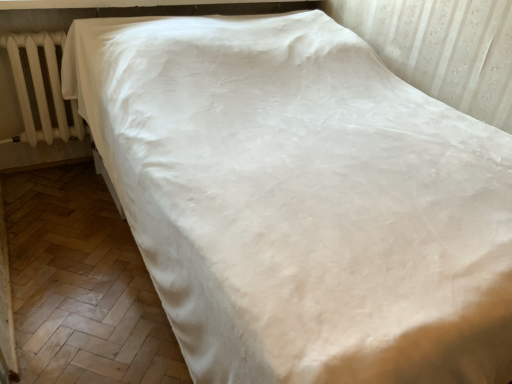
In order to face smooth black window sill at upper center, should I rotate leftwards or rightwards?

To align with it, rotate left about 9.581°.

Where is `smooth black window sill at upper center`? The height and width of the screenshot is (384, 512). smooth black window sill at upper center is located at coordinates (123, 3).

What do you see at coordinates (123, 3) in the screenshot?
I see `smooth black window sill at upper center` at bounding box center [123, 3].

Where is `white plastic radiator at left`? white plastic radiator at left is located at coordinates (41, 88).

What do you see at coordinates (41, 88) in the screenshot? I see `white plastic radiator at left` at bounding box center [41, 88].

From the picture: Measure the distance between point (35, 53) and camera.

2.15 meters.

Locate an element on the screen. The width and height of the screenshot is (512, 384). smooth black window sill at upper center is located at coordinates (123, 3).

Which object is positioned more to the right, smooth black window sill at upper center or white plastic radiator at left?

From the viewer's perspective, smooth black window sill at upper center appears more on the right side.

Between smooth black window sill at upper center and white plastic radiator at left, which one is positioned behind?

Positioned behind is white plastic radiator at left.

Is point (304, 0) in front of point (61, 125)?

No, it is not.

From the image's perspective, is smooth black window sill at upper center above white plastic radiator at left?

Yes, from the image's perspective, smooth black window sill at upper center is on top of white plastic radiator at left.

From a real-world perspective, which is physically above, smooth black window sill at upper center or white plastic radiator at left?

smooth black window sill at upper center is physically above.

Which of these two, smooth black window sill at upper center or white plastic radiator at left, is thinner?

Thinner between the two is white plastic radiator at left.

Considering the relative sizes of smooth black window sill at upper center and white plastic radiator at left in the image provided, is smooth black window sill at upper center shorter than white plastic radiator at left?

Correct, smooth black window sill at upper center is not as tall as white plastic radiator at left.

Between smooth black window sill at upper center and white plastic radiator at left, which one has larger size?

white plastic radiator at left is bigger.

Consider the image. Would you say smooth black window sill at upper center contains white plastic radiator at left?

No, white plastic radiator at left is not inside smooth black window sill at upper center.

Does smooth black window sill at upper center touch white plastic radiator at left?

There is a gap between smooth black window sill at upper center and white plastic radiator at left.

Is smooth black window sill at upper center positioned with its back to white plastic radiator at left?

No.

Can you tell me how much smooth black window sill at upper center and white plastic radiator at left differ in facing direction?

They differ by 0.38 degrees in their facing directions.

This screenshot has height=384, width=512. In the image, there is a smooth black window sill at upper center. Identify the location of radiator below it (from a real-world perspective). (41, 88).

Considering the relative positions of white plastic radiator at left and smooth black window sill at upper center in the image provided, is white plastic radiator at left to the left or to the right of smooth black window sill at upper center?

From the image, it's evident that white plastic radiator at left is to the left of smooth black window sill at upper center.

Is white plastic radiator at left positioned before smooth black window sill at upper center?

No.

Which is nearer, (19, 92) or (10, 8)?

Point (19, 92) is farther from the camera than point (10, 8).

From the image's perspective, is white plastic radiator at left beneath smooth black window sill at upper center?

Yes, from the image's perspective, white plastic radiator at left is below smooth black window sill at upper center.

From a real-world perspective, is white plastic radiator at left physically located above or below smooth black window sill at upper center?

white plastic radiator at left is below smooth black window sill at upper center.

Is white plastic radiator at left wider or thinner than smooth black window sill at upper center?

Considering their sizes, white plastic radiator at left looks slimmer than smooth black window sill at upper center.

Looking at this image, considering the sizes of objects white plastic radiator at left and smooth black window sill at upper center in the image provided, who is taller, white plastic radiator at left or smooth black window sill at upper center?

white plastic radiator at left is taller.

Is white plastic radiator at left bigger or smaller than smooth black window sill at upper center?

Considering their sizes, white plastic radiator at left takes up more space than smooth black window sill at upper center.

Does white plastic radiator at left contain smooth black window sill at upper center?

That's incorrect, smooth black window sill at upper center is not inside white plastic radiator at left.

Is the surface of white plastic radiator at left in direct contact with smooth black window sill at upper center?

No, white plastic radiator at left is not next to smooth black window sill at upper center.

Could you tell me if white plastic radiator at left is facing smooth black window sill at upper center?

No, white plastic radiator at left is not turned towards smooth black window sill at upper center.

How different are the orientations of white plastic radiator at left and smooth black window sill at upper center in degrees?

The angle between the facing direction of white plastic radiator at left and the facing direction of smooth black window sill at upper center is 0.38 degrees.

Where is `radiator below the smooth black window sill at upper center (from a real-world perspective)`? radiator below the smooth black window sill at upper center (from a real-world perspective) is located at coordinates (41, 88).

Where is `radiator behind the smooth black window sill at upper center`? radiator behind the smooth black window sill at upper center is located at coordinates (41, 88).

Find the location of a particular element. window sill that appears in front of the white plastic radiator at left is located at coordinates (123, 3).